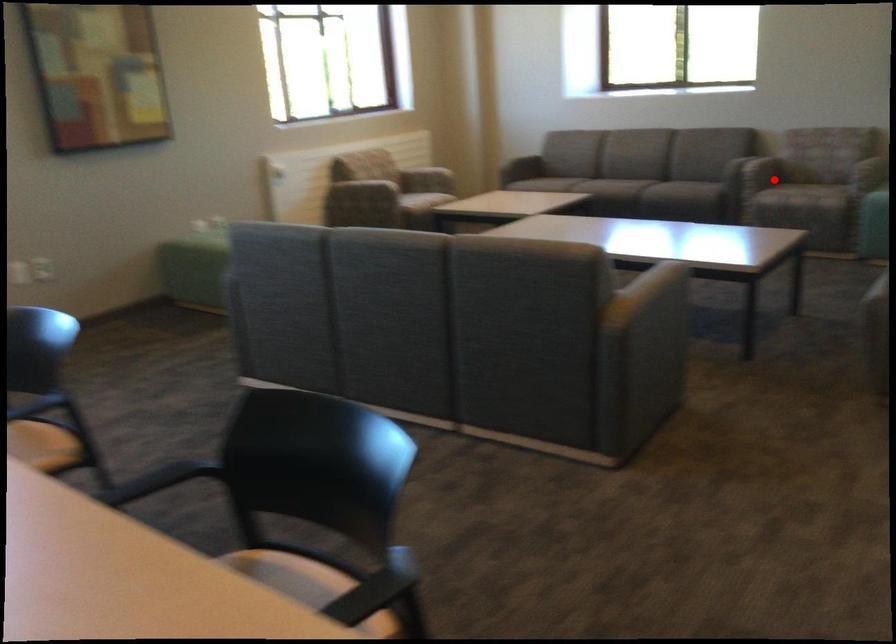
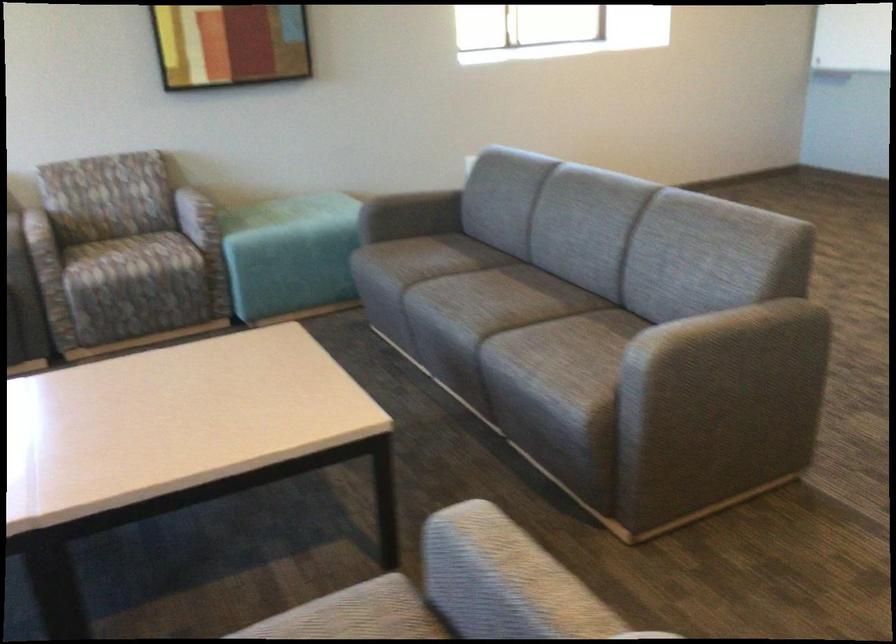
Question: I am providing you with two images of the same scene from different viewpoints. Given a red point in image1, look at the same physical point in image2. Is it:

Choices:
 (A) Closer to the viewpoint
 (B) Farther from the viewpoint

Answer: (A)